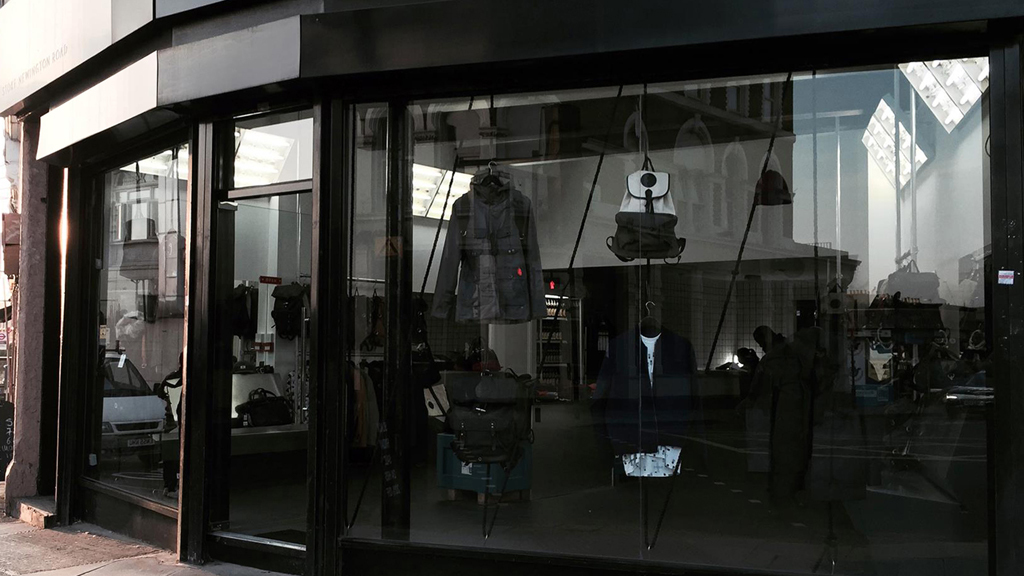
Find the location of a particular element. This screenshot has width=1024, height=576. coat is located at coordinates (495, 271).